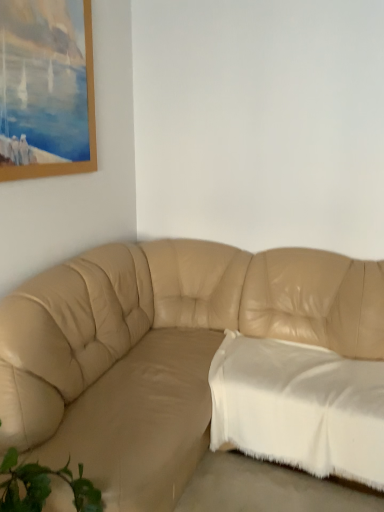
What is the approximate height of beige leather couch at center?

beige leather couch at center is 36.43 inches tall.

What do you see at coordinates (160, 351) in the screenshot?
I see `beige leather couch at center` at bounding box center [160, 351].

Locate an element on the screen. Image resolution: width=384 pixels, height=512 pixels. beige leather couch at center is located at coordinates (160, 351).

Where is `beige leather couch at center`? The image size is (384, 512). beige leather couch at center is located at coordinates (160, 351).